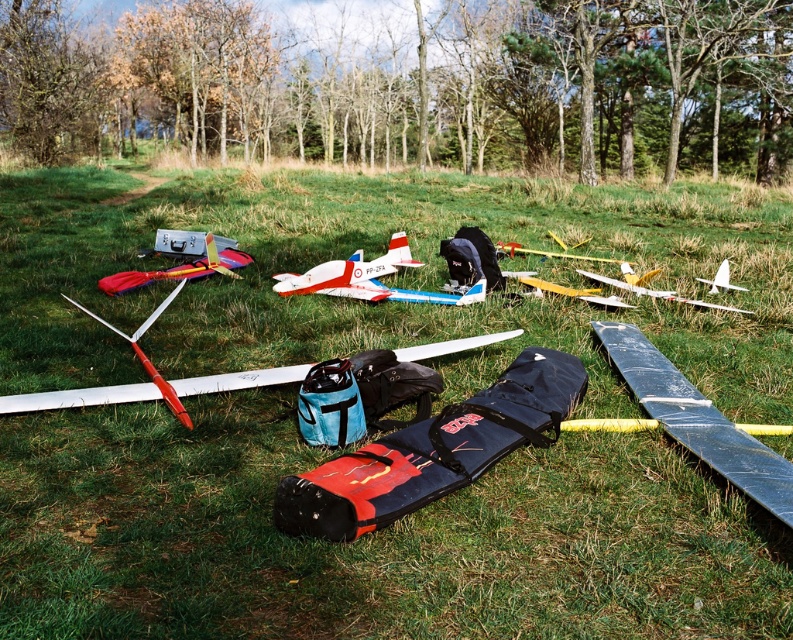
You are standing in the park and want to place a new model airplane between the two points, point (6, 403) and point (653, 292). Which point should you place it closer to so that it appears larger in the image?

You should place the model airplane closer to point (6, 403) because it is closer to the viewer, making the airplane appear larger in the image.

You are a photographer setting up a tripod in the grassy area. You want to capture both the red and white plastic airplane at center and the yellow matte airplane at center in your shot. Which airplane should you position your camera to the left of to include both in the frame?

You should position your camera to the left of the yellow matte airplane at center. Since the red and white plastic airplane at center is on the left side of the yellow matte airplane at center, this placement will ensure both airplanes are included in the frame.